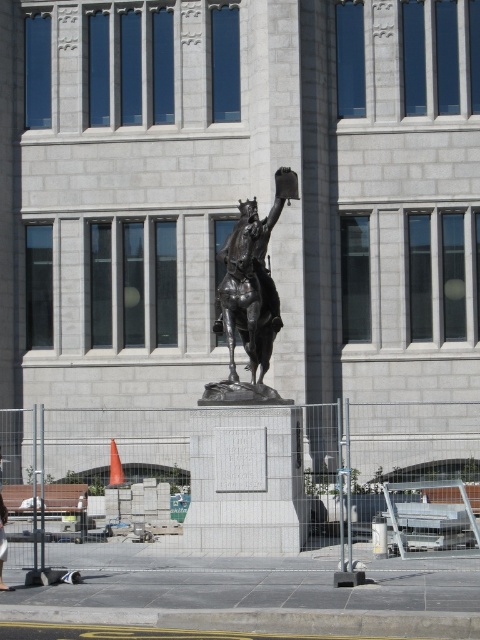
Question: Which point is closer to the camera taking this photo?

Choices:
 (A) (0, 547)
 (B) (45, 556)

Answer: (A)

Question: Is bronze statue at center thinner than light brown wooden bench at center?

Choices:
 (A) no
 (B) yes

Answer: (B)

Question: From the image, what is the correct spatial relationship of concrete fence at center in relation to light brown wooden bench at center?

Choices:
 (A) above
 (B) below

Answer: (A)

Question: Estimate the real-world distances between objects in this image. Which object is closer to the light brown wooden bench at center?

Choices:
 (A) bronze statue at center
 (B) concrete fence at center

Answer: (B)

Question: Which object is farther from the camera taking this photo?

Choices:
 (A) light brown wooden bench at center
 (B) bronze statue at center

Answer: (B)

Question: Is concrete fence at center below light brown wooden bench at center?

Choices:
 (A) no
 (B) yes

Answer: (A)